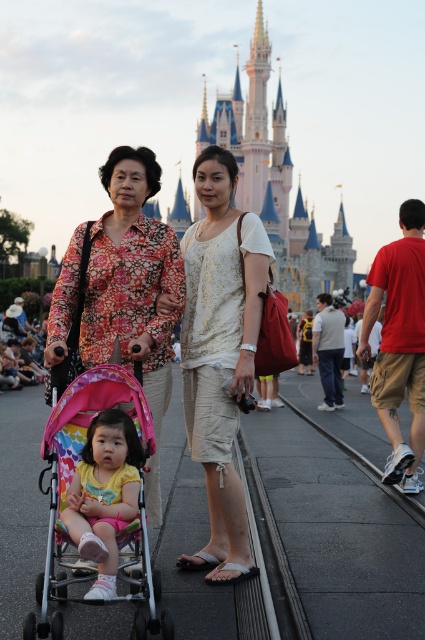
Is white cotton dress at center thinner than floral fabric dress at center?

Correct, white cotton dress at center's width is less than floral fabric dress at center's.

Is point (231, 522) in front of point (108, 248)?

Yes, point (231, 522) is in front of point (108, 248).

Is point (229, 580) behind point (153, 324)?

No.

Find the location of `white cotton dress at center`. white cotton dress at center is located at coordinates (220, 355).

Is white cotton dress at center shorter than pastel pink fabric stroller at center?

Incorrect, white cotton dress at center's height does not fall short of pastel pink fabric stroller at center's.

What do you see at coordinates (220, 355) in the screenshot? The image size is (425, 640). I see `white cotton dress at center` at bounding box center [220, 355].

What are the coordinates of `white cotton dress at center` in the screenshot? It's located at (220, 355).

Identify the location of floral fabric dress at center. (132, 278).

Looking at this image, between floral fabric dress at center and multicolored fabric baby carriage at center, which one appears on the left side from the viewer's perspective?

From the viewer's perspective, multicolored fabric baby carriage at center appears more on the left side.

Which is behind, point (102, 253) or point (51, 442)?

Positioned behind is point (102, 253).

The width and height of the screenshot is (425, 640). What are the coordinates of `floral fabric dress at center` in the screenshot? It's located at tap(132, 278).